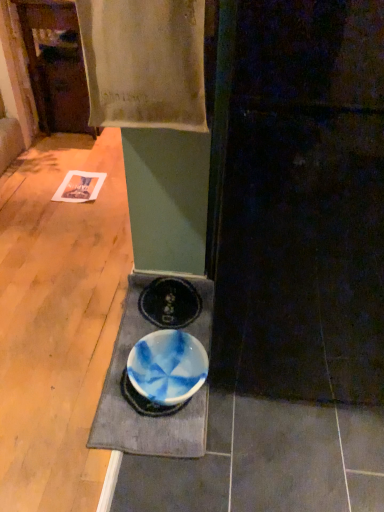
Locate an element on the screen. This screenshot has width=384, height=512. blank space to the left of smooth dark wood door at center is located at coordinates (79, 351).